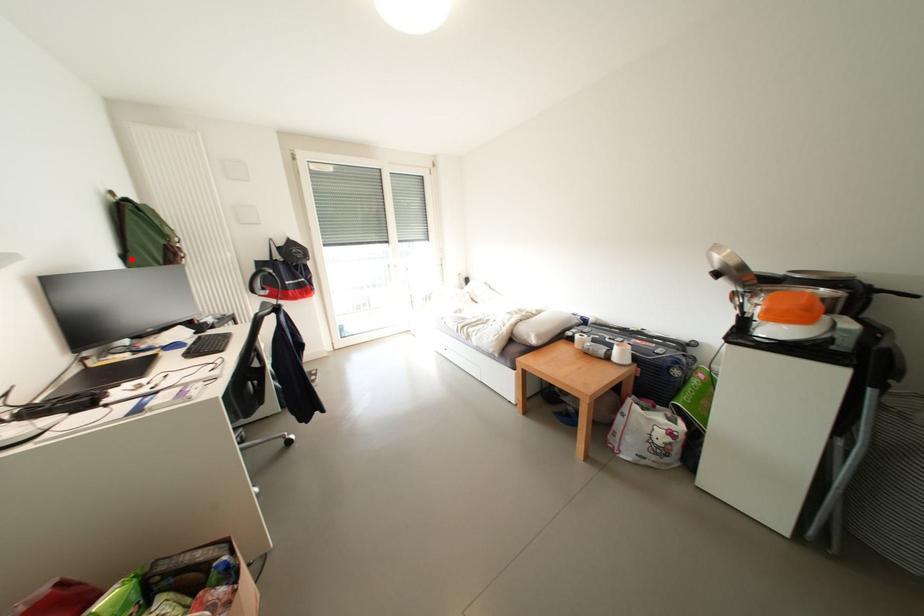
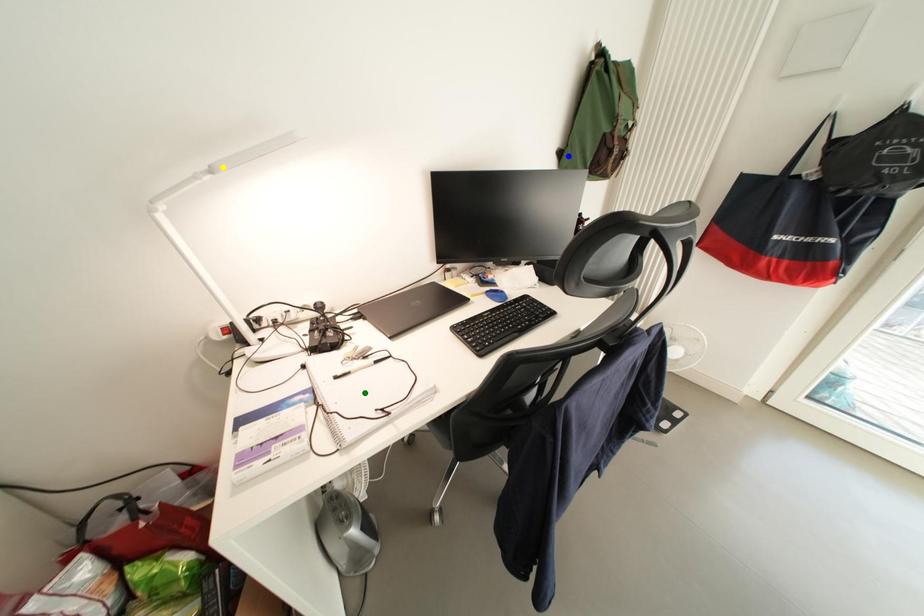
Question: I am providing you with two images of the same scene from different viewpoints. A red point is marked on the first image. You are given multiple points on the second image. Can you choose the point in image 2 that corresponds to the point in image 1?

Choices:
 (A) green point
 (B) blue point
 (C) yellow point

Answer: (B)